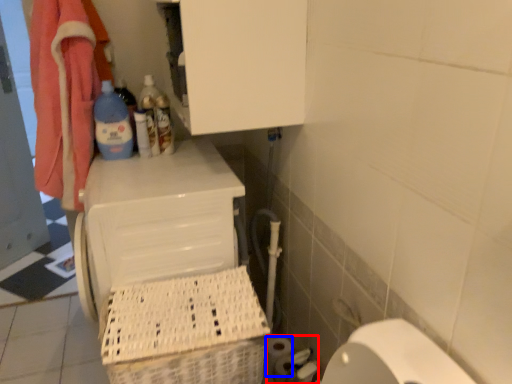
Question: Among these objects, which one is farthest to the camera, toilet paper (highlighted by a red box) or toilet paper (highlighted by a blue box)?

Choices:
 (A) toilet paper
 (B) toilet paper

Answer: (B)